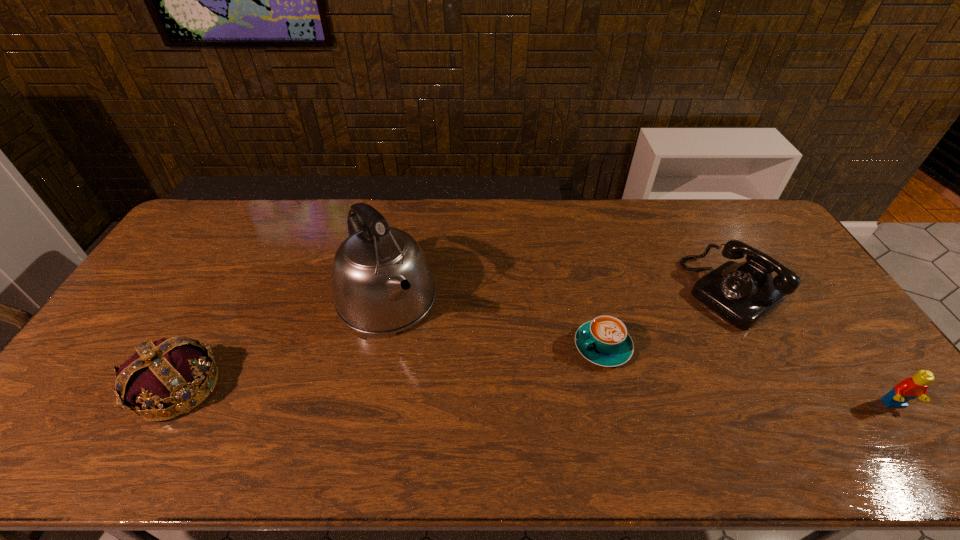
Identify the location of free space located 0.180m with the handle on the right side of the shortest object. (525, 389).

Where is `vacant point located 0.070m with the handle on the right side of the shortest object`? vacant point located 0.070m with the handle on the right side of the shortest object is located at coordinates (560, 370).

Locate an element on the screen. This screenshot has width=960, height=540. vacant space located on the dial of the fourth object from left to right is located at coordinates (688, 326).

At what (x,y) coordinates should I click in order to perform the action: click on vacant space located on the dial of the fourth object from left to right. Please return your answer as a coordinate pair (x, y). Image resolution: width=960 pixels, height=540 pixels. Looking at the image, I should click on (631, 367).

This screenshot has width=960, height=540. I want to click on vacant space located on the dial of the fourth object from left to right, so click(672, 338).

Identify the location of vacant space situated 0.170m on the spout of the second object from left to right. The height and width of the screenshot is (540, 960). (436, 384).

The image size is (960, 540). I want to click on free space located on the spout of the second object from left to right, so click(x=422, y=362).

This screenshot has width=960, height=540. In order to click on free space located 0.080m on the spout of the second object from left to right in this screenshot , I will do `click(420, 359)`.

Where is `crown that is at the near edge`? Image resolution: width=960 pixels, height=540 pixels. crown that is at the near edge is located at coordinates (180, 372).

Locate an element on the screen. Lego located at the near edge is located at coordinates (910, 388).